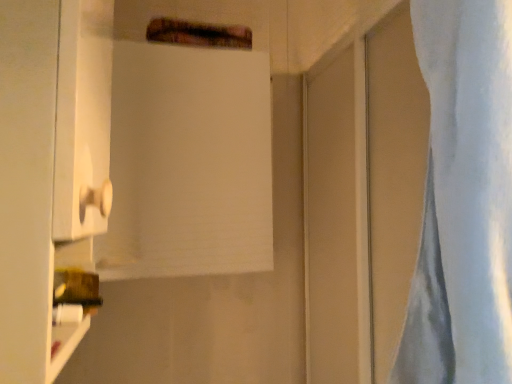
Measure the distance between white matte curtain at right and camera.

19.28 inches.

The image size is (512, 384). Describe the element at coordinates (463, 199) in the screenshot. I see `white matte curtain at right` at that location.

What is the approximate height of white matte curtain at right?

white matte curtain at right is 34.53 inches in height.

Find the location of a particular element. This screenshot has width=512, height=384. white matte curtain at right is located at coordinates (463, 199).

I want to click on white matte curtain at right, so click(x=463, y=199).